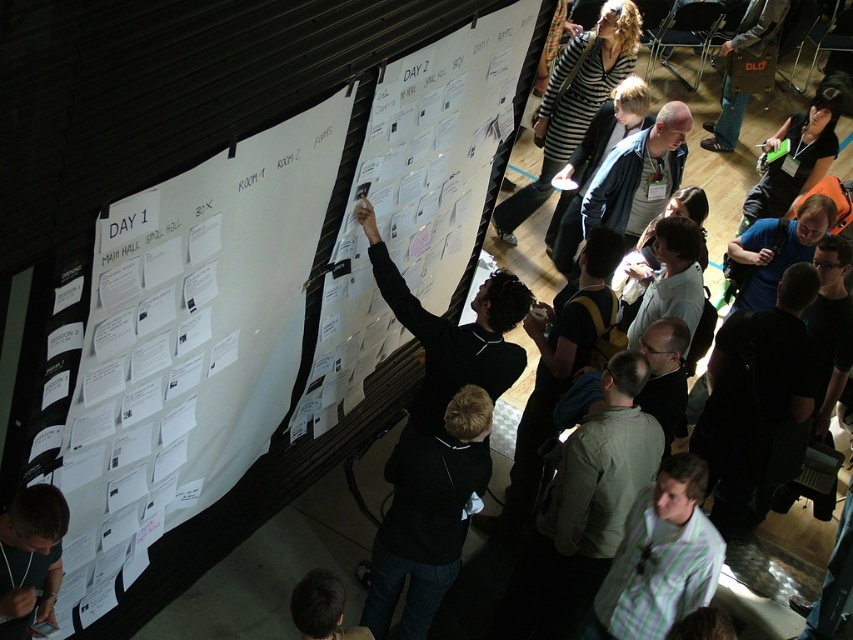
You are an event planner standing in front of the wall with the white paper at center and the black matte jacket at center. Which object is taller?

The white paper at center is taller than the black matte jacket at center.

What are the coordinates of the white paper at center?

The white paper at center is located at coordinates point (418,198).